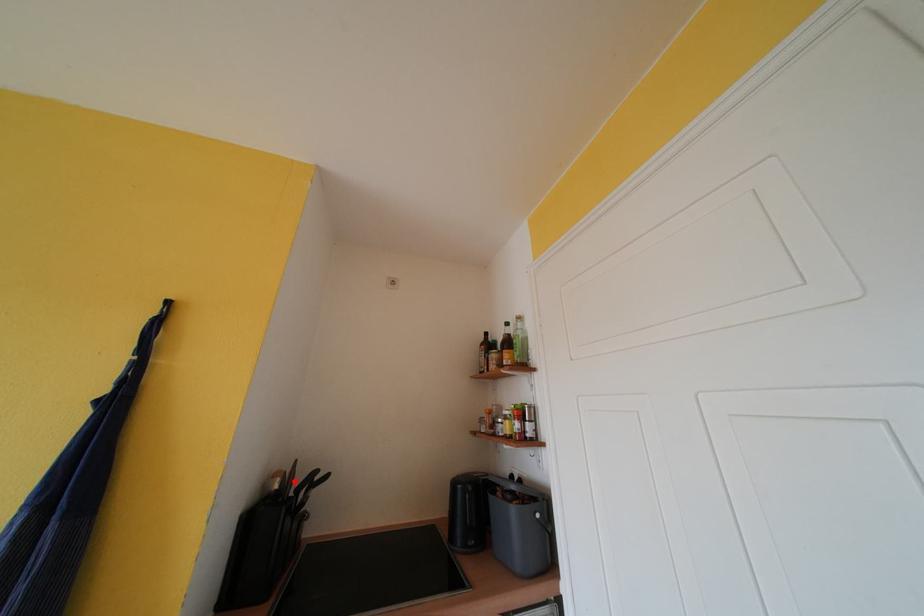
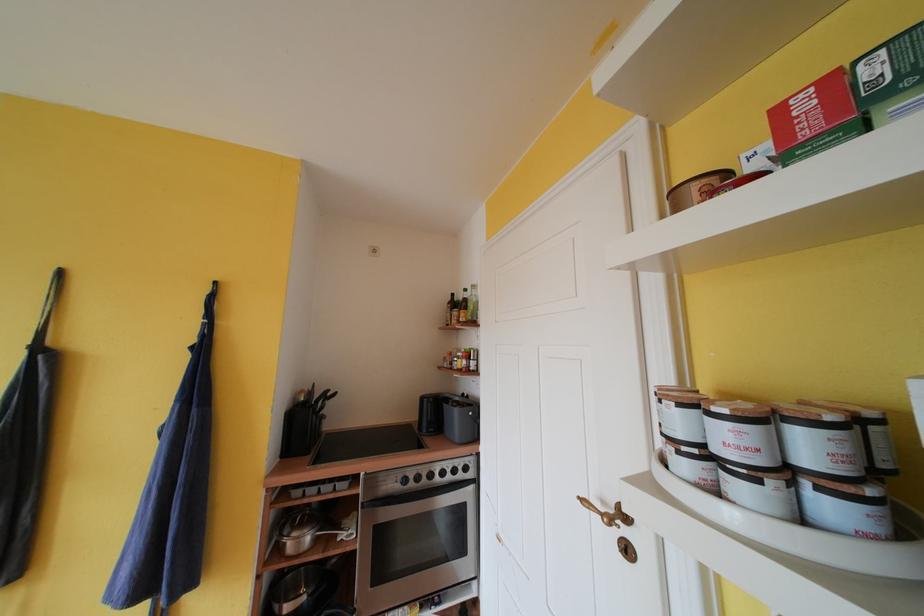
The point at the highlighted location is marked in the first image. Where is the corresponding point in the second image?

(315, 398)